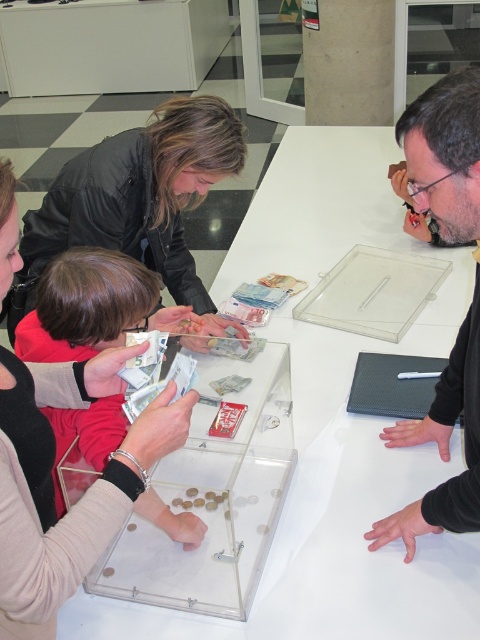
Does transparent acrylic box at center appear under black matte laptop at upper right?

Correct, transparent acrylic box at center is located below black matte laptop at upper right.

Can you confirm if transparent acrylic box at center is bigger than black matte laptop at upper right?

Correct, transparent acrylic box at center is larger in size than black matte laptop at upper right.

This screenshot has height=640, width=480. Find the location of `transparent acrylic box at center`. transparent acrylic box at center is located at coordinates (214, 502).

Between black matte laptop at upper right and red fabric child at lower left, which one has more height?

Standing taller between the two is black matte laptop at upper right.

How far apart are black matte laptop at upper right and red fabric child at lower left?

black matte laptop at upper right is 24.77 inches from red fabric child at lower left.

Does point (478, 122) lie in front of point (91, 280)?

Yes, it is in front of point (91, 280).

The height and width of the screenshot is (640, 480). I want to click on black matte laptop at upper right, so click(x=466, y=314).

Measure the distance from transparent acrylic box at center to matte black jacket at upper left.

A distance of 21.57 inches exists between transparent acrylic box at center and matte black jacket at upper left.

Between transparent acrylic box at center and matte black jacket at upper left, which one has more height?

matte black jacket at upper left

Is point (224, 518) positioned before point (157, 234)?

Yes, point (224, 518) is in front of point (157, 234).

Find the location of a particular element. The image size is (480, 640). transparent acrylic box at center is located at coordinates (214, 502).